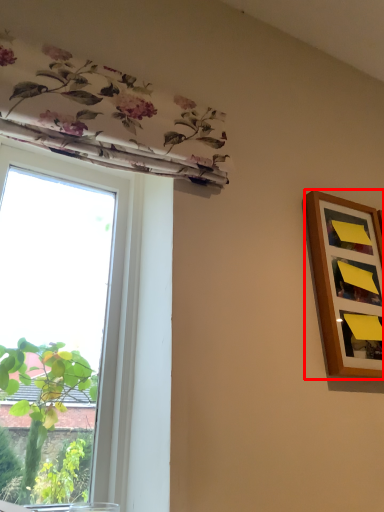
Question: From the image's perspective, what is the correct spatial positioning of picture frame (annotated by the red box) in reference to window?

Choices:
 (A) above
 (B) below

Answer: (A)